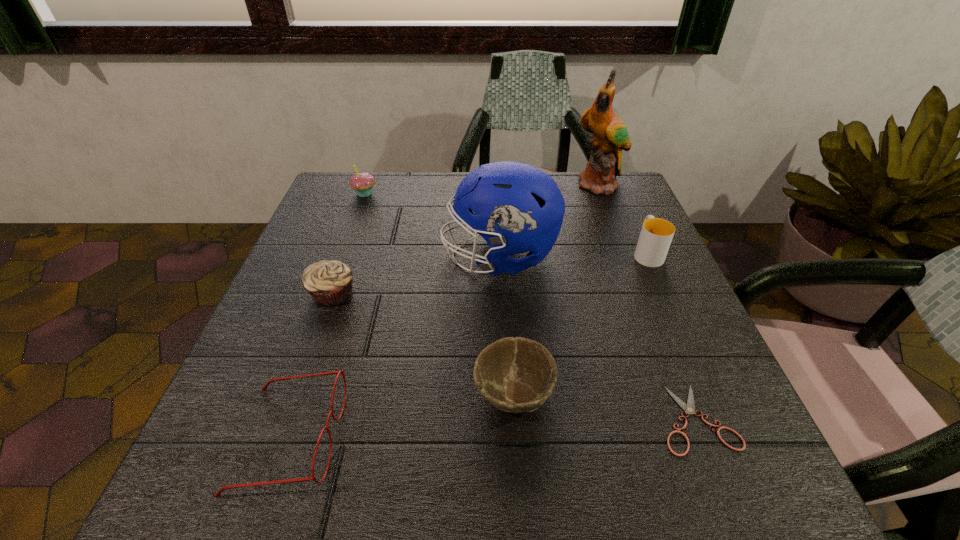
Where is `free space located 0.330m on the front-facing side of the seventh shortest object`? free space located 0.330m on the front-facing side of the seventh shortest object is located at coordinates (293, 256).

Where is `vacant space located 0.170m on the front-facing side of the seventh shortest object`? vacant space located 0.170m on the front-facing side of the seventh shortest object is located at coordinates (365, 256).

Find the location of `vacant space located on the right of the cupcake`. vacant space located on the right of the cupcake is located at coordinates (505, 193).

Identify the location of free space located with the handle on the side of the cup. (619, 190).

Find the location of `vacant space located with the handle on the side of the cup`. vacant space located with the handle on the side of the cup is located at coordinates (635, 224).

Locate an element on the screen. This screenshot has height=540, width=960. vacant region located 0.230m with the handle on the side of the cup is located at coordinates (618, 188).

Find the location of a particular element. blank area located on the right of the muffin is located at coordinates (451, 293).

This screenshot has width=960, height=540. Find the location of `free spot located 0.290m on the right of the bowl`. free spot located 0.290m on the right of the bowl is located at coordinates (732, 395).

Where is `vacant region located 0.160m on the face of the spectacles`? vacant region located 0.160m on the face of the spectacles is located at coordinates (444, 438).

Find the location of a particular element. Image resolution: width=960 pixels, height=540 pixels. vacant region located on the left of the shortest object is located at coordinates (568, 419).